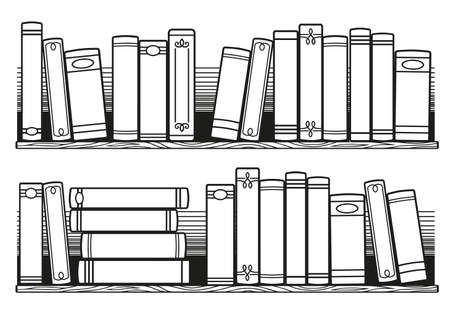
Find the location of `horizontal books`. horizontal books is located at coordinates (127, 197), (130, 217), (137, 241), (140, 273).